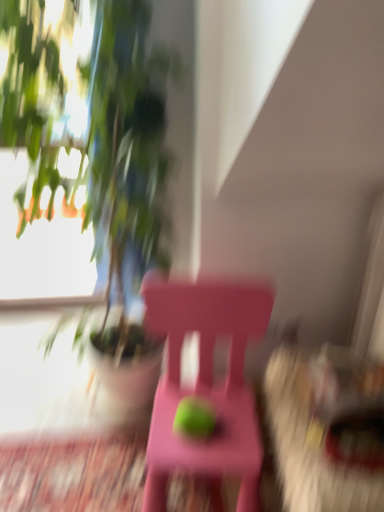
Question: Considering the relative positions of green matte plant at upper left and pink plastic chair at center in the image provided, is green matte plant at upper left behind pink plastic chair at center?

Choices:
 (A) yes
 (B) no

Answer: (B)

Question: Is green matte plant at upper left to the right of pink plastic chair at center from the viewer's perspective?

Choices:
 (A) no
 (B) yes

Answer: (A)

Question: Is green matte plant at upper left directly adjacent to pink plastic chair at center?

Choices:
 (A) no
 (B) yes

Answer: (A)

Question: Considering the relative positions of green matte plant at upper left and pink plastic chair at center in the image provided, is green matte plant at upper left in front of pink plastic chair at center?

Choices:
 (A) yes
 (B) no

Answer: (A)

Question: Considering the relative sizes of green matte plant at upper left and pink plastic chair at center in the image provided, is green matte plant at upper left wider than pink plastic chair at center?

Choices:
 (A) yes
 (B) no

Answer: (A)

Question: Considering the relative sizes of green matte plant at upper left and pink plastic chair at center in the image provided, is green matte plant at upper left thinner than pink plastic chair at center?

Choices:
 (A) no
 (B) yes

Answer: (A)

Question: From a real-world perspective, is green matte apple at center positioned over pink plastic chair at center based on gravity?

Choices:
 (A) no
 (B) yes

Answer: (B)

Question: Is the surface of green matte apple at center in direct contact with pink plastic chair at center?

Choices:
 (A) yes
 (B) no

Answer: (B)

Question: Considering the relative sizes of green matte apple at center and pink plastic chair at center in the image provided, is green matte apple at center wider than pink plastic chair at center?

Choices:
 (A) no
 (B) yes

Answer: (A)

Question: From the image's perspective, is green matte apple at center above pink plastic chair at center?

Choices:
 (A) no
 (B) yes

Answer: (A)

Question: Can we say green matte apple at center lies outside pink plastic chair at center?

Choices:
 (A) no
 (B) yes

Answer: (A)

Question: Is green matte apple at center closer to the viewer compared to pink plastic chair at center?

Choices:
 (A) yes
 (B) no

Answer: (B)

Question: Does green matte plant at upper left come in front of green matte apple at center?

Choices:
 (A) yes
 (B) no

Answer: (A)